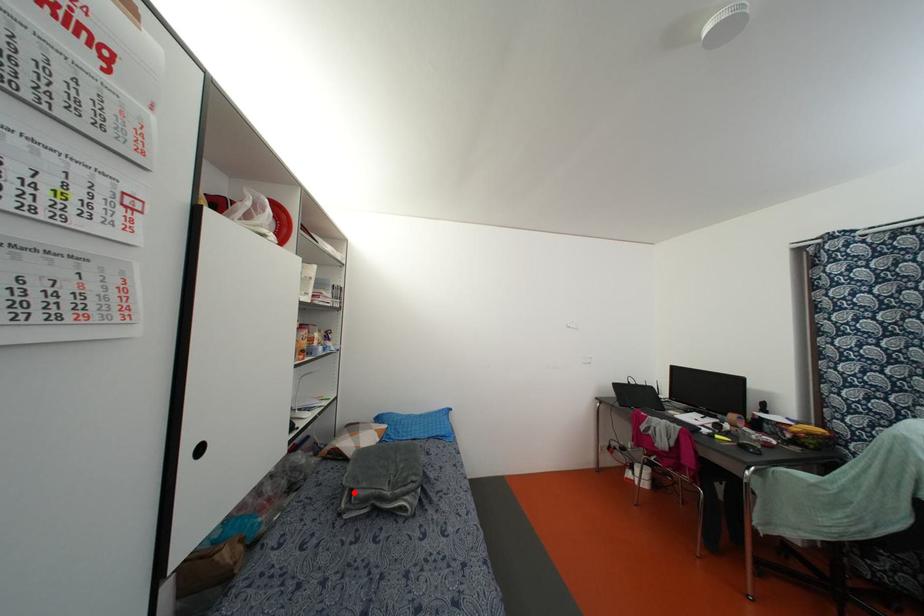
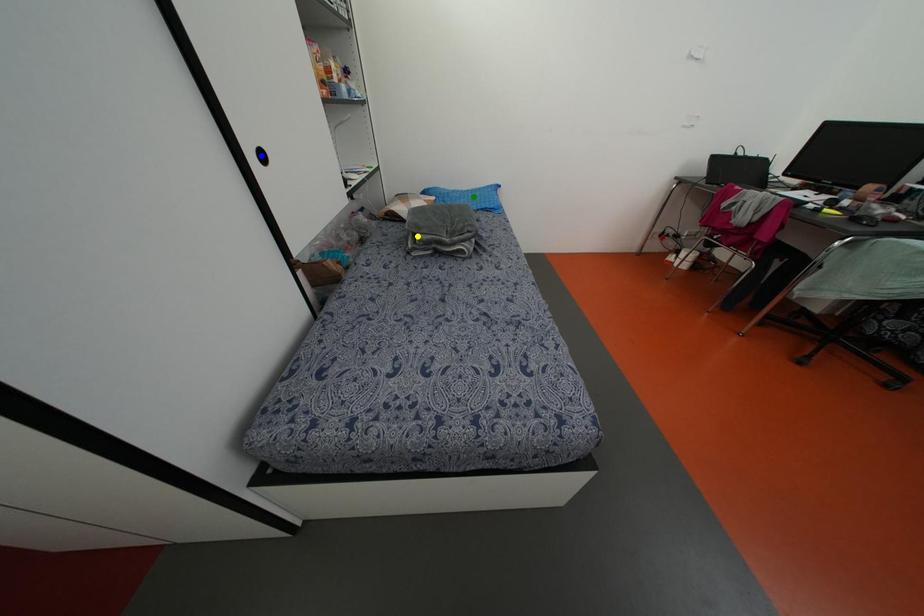
Question: I am providing you with two images of the same scene from different viewpoints. A red point is marked on the first image. You are given multiple points on the second image. Which point in image 2 is actually the same real-world point as the red point in image 1?

Choices:
 (A) yellow point
 (B) blue point
 (C) green point

Answer: (A)